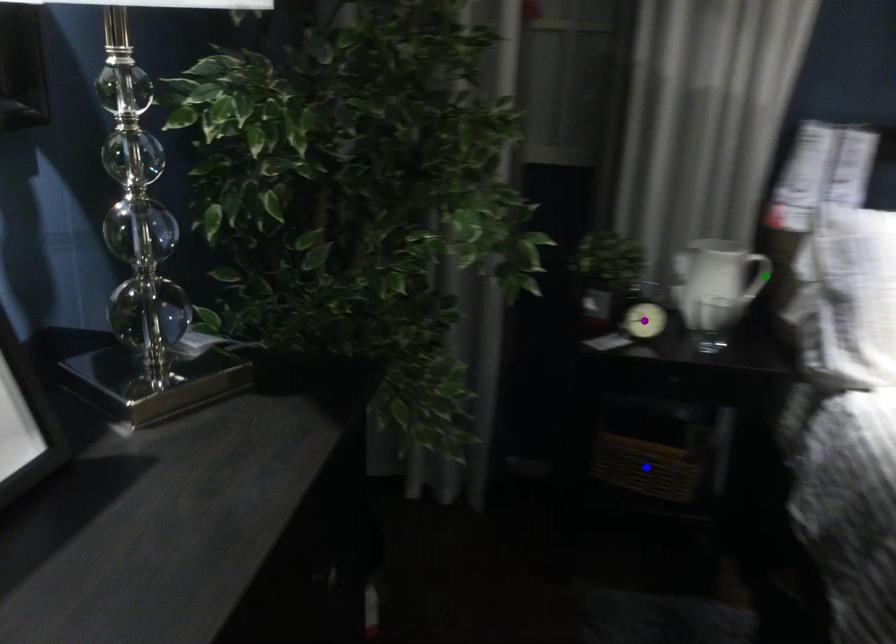
Order these from nearest to farthest:
- blue point
- green point
- purple point

purple point
green point
blue point